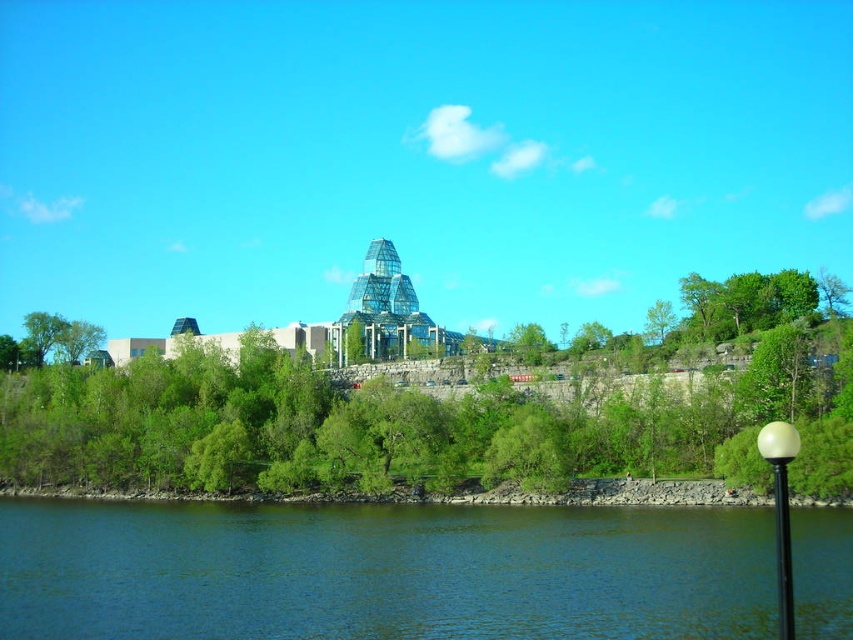
Question: In this image, where is white glossy lamp post at lower right located relative to black glossy pole at lower right?

Choices:
 (A) right
 (B) left

Answer: (A)

Question: Estimate the real-world distances between objects in this image. Which object is farther from the black glossy pole at lower right?

Choices:
 (A) blue water at lower center
 (B) green leafy tree at center

Answer: (B)

Question: Considering the relative positions of green leafy tree at center and black glossy pole at lower right in the image provided, where is green leafy tree at center located with respect to black glossy pole at lower right?

Choices:
 (A) right
 (B) left

Answer: (B)

Question: Among these objects, which one is nearest to the camera?

Choices:
 (A) green leafy tree at center
 (B) blue water at lower center
 (C) white glossy lamp post at lower right

Answer: (C)

Question: Is white glossy lamp post at lower right to the right of black glossy pole at lower right from the viewer's perspective?

Choices:
 (A) yes
 (B) no

Answer: (A)

Question: Estimate the real-world distances between objects in this image. Which object is farther from the green leafy tree at center?

Choices:
 (A) blue water at lower center
 (B) black glossy pole at lower right
 (C) white glossy lamp post at lower right

Answer: (B)